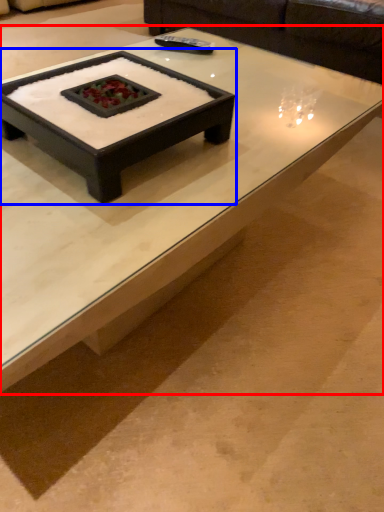
Question: Which point is closer to the camera, coffee table (highlighted by a red box) or coffee table (highlighted by a blue box)?

Choices:
 (A) coffee table
 (B) coffee table

Answer: (A)